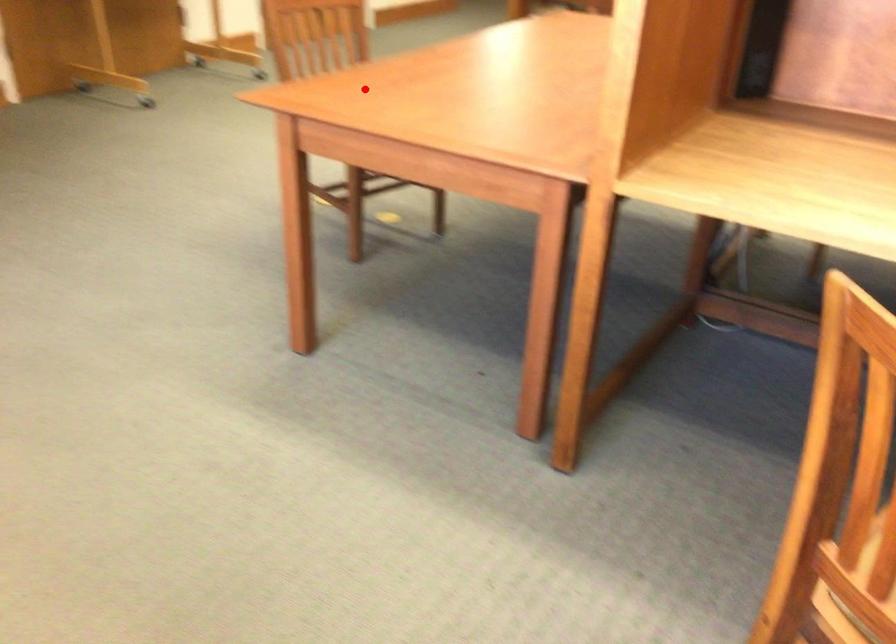
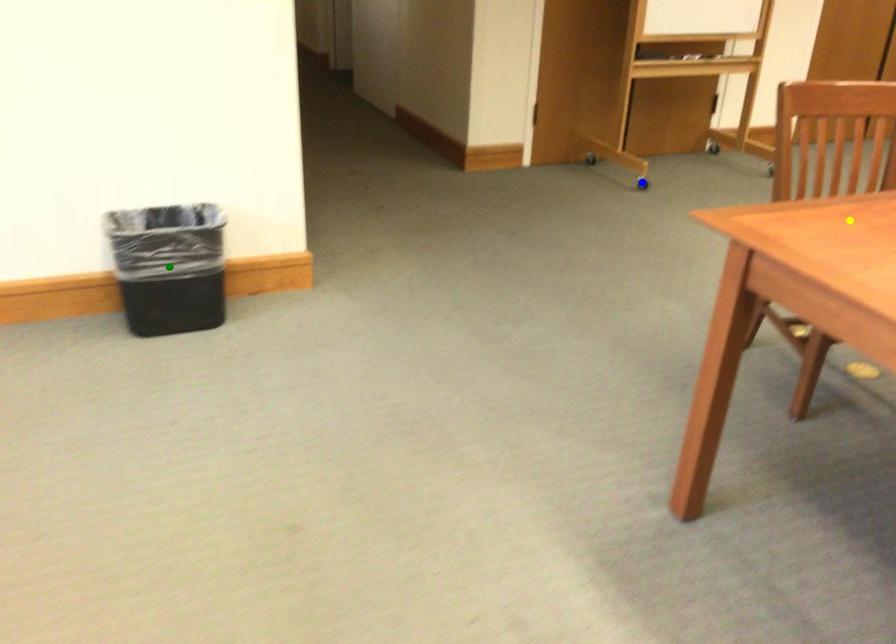
Question: I am providing you with two images of the same scene from different viewpoints. A red point is marked on the first image. You are given multiple points on the second image. In image 2, which mark is for the same physical point as the one in image 1?

Choices:
 (A) blue point
 (B) yellow point
 (C) green point

Answer: (B)